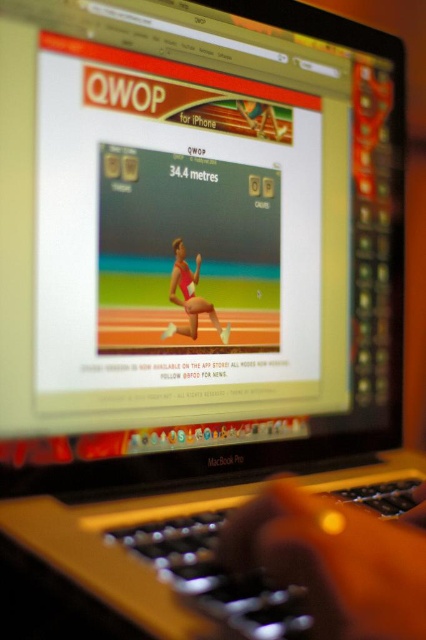
Question: Considering the relative positions of black plastic keyboard at lower center and matte pink swimsuit at center in the image provided, where is black plastic keyboard at lower center located with respect to matte pink swimsuit at center?

Choices:
 (A) right
 (B) left

Answer: (A)

Question: Which of the following is the closest to the observer?

Choices:
 (A) black plastic keyboard at lower center
 (B) matte pink swimsuit at center

Answer: (A)

Question: Does black plastic keyboard at lower center appear over matte pink swimsuit at center?

Choices:
 (A) no
 (B) yes

Answer: (A)

Question: Where is black plastic keyboard at lower center located in relation to matte pink swimsuit at center in the image?

Choices:
 (A) below
 (B) above

Answer: (A)

Question: Among these objects, which one is farthest from the camera?

Choices:
 (A) black plastic keyboard at lower center
 (B) matte pink swimsuit at center

Answer: (B)

Question: Among these points, which one is nearest to the camera?

Choices:
 (A) (175, 278)
 (B) (187, 589)

Answer: (B)